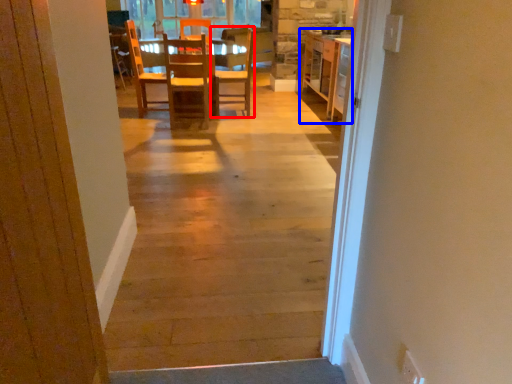
Question: Which point is further to the camera, chair (highlighted by a red box) or cabinetry (highlighted by a blue box)?

Choices:
 (A) chair
 (B) cabinetry

Answer: (B)